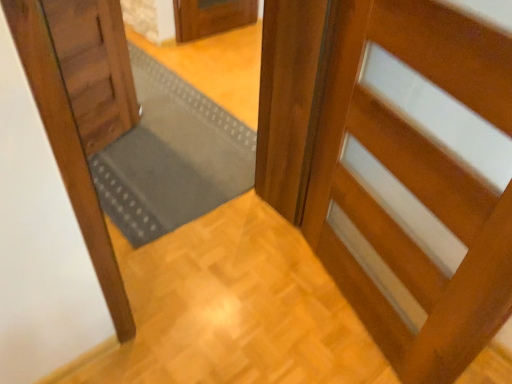
Question: Is glossy wood door at right, the first door positioned from the right, located outside wooden door at left, positioned as the second door in right-to-left order?

Choices:
 (A) no
 (B) yes

Answer: (B)

Question: Can you confirm if glossy wood door at right, positioned as the 2th door in left-to-right order, is smaller than wooden door at left, positioned as the second door in right-to-left order?

Choices:
 (A) yes
 (B) no

Answer: (B)

Question: Is glossy wood door at right, the first door positioned from the right, beside wooden door at left, placed as the 1th door when sorted from left to right?

Choices:
 (A) no
 (B) yes

Answer: (A)

Question: Is the depth of glossy wood door at right, positioned as the 2th door in left-to-right order, greater than that of wooden door at left, positioned as the second door in right-to-left order?

Choices:
 (A) no
 (B) yes

Answer: (A)

Question: Does glossy wood door at right, the first door positioned from the right, have a greater width compared to wooden door at left, positioned as the second door in right-to-left order?

Choices:
 (A) no
 (B) yes

Answer: (A)

Question: From a real-world perspective, is glossy wood door at right, the first door positioned from the right, on top of wooden door at left, positioned as the second door in right-to-left order?

Choices:
 (A) no
 (B) yes

Answer: (B)

Question: From a real-world perspective, does wooden staircase at lower right stand above glossy wood door at right, the first door positioned from the right?

Choices:
 (A) no
 (B) yes

Answer: (A)

Question: Considering the relative sizes of wooden staircase at lower right and glossy wood door at right, the first door positioned from the right, in the image provided, is wooden staircase at lower right smaller than glossy wood door at right, the first door positioned from the right,?

Choices:
 (A) no
 (B) yes

Answer: (B)

Question: Is wooden staircase at lower right shorter than glossy wood door at right, positioned as the 2th door in left-to-right order?

Choices:
 (A) no
 (B) yes

Answer: (B)

Question: Is glossy wood door at right, positioned as the 2th door in left-to-right order, located within wooden staircase at lower right?

Choices:
 (A) no
 (B) yes

Answer: (A)

Question: Are wooden staircase at lower right and glossy wood door at right, the first door positioned from the right, located far from each other?

Choices:
 (A) yes
 (B) no

Answer: (B)

Question: Does wooden staircase at lower right have a greater height compared to glossy wood door at right, the first door positioned from the right?

Choices:
 (A) no
 (B) yes

Answer: (A)

Question: Does wooden door at left, placed as the 1th door when sorted from left to right, have a lesser height compared to glossy wood door at right, positioned as the 2th door in left-to-right order?

Choices:
 (A) no
 (B) yes

Answer: (B)